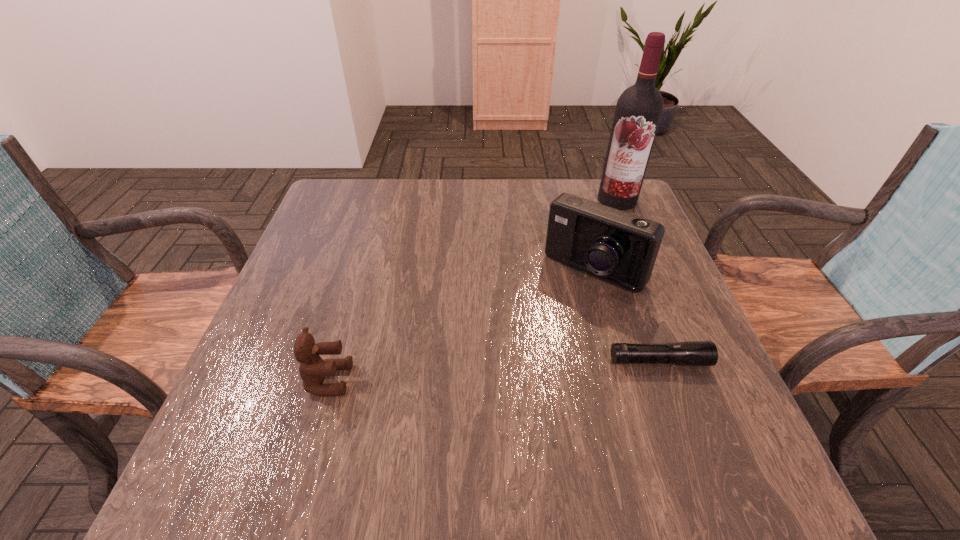
The width and height of the screenshot is (960, 540). In order to click on object that is positioned at the near left corner in this screenshot , I will do `click(313, 369)`.

At what (x,y) coordinates should I click in order to perform the action: click on object that is at the far right corner. Please return your answer as a coordinate pair (x, y). Looking at the image, I should click on (639, 108).

Locate an element on the screen. blank space at the far edge is located at coordinates (415, 179).

Locate an element on the screen. Image resolution: width=960 pixels, height=540 pixels. vacant area at the left edge is located at coordinates (300, 285).

At what (x,y) coordinates should I click in order to perform the action: click on free location at the right edge of the desktop. Please return your answer as a coordinate pair (x, y). The width and height of the screenshot is (960, 540). Looking at the image, I should click on (694, 332).

In the image, there is a desktop. Identify the location of vacant space at the far left corner. (312, 223).

Where is `vacant region at the far right corner of the desktop`? Image resolution: width=960 pixels, height=540 pixels. vacant region at the far right corner of the desktop is located at coordinates (592, 186).

Locate an element on the screen. The width and height of the screenshot is (960, 540). free location at the near right corner of the desktop is located at coordinates (663, 413).

Identify the location of vacant space in between the camera and the teddy bear. The image size is (960, 540). (461, 325).

Where is `vacant space that is in between the wine bottle and the leftmost object`? The height and width of the screenshot is (540, 960). vacant space that is in between the wine bottle and the leftmost object is located at coordinates (473, 290).